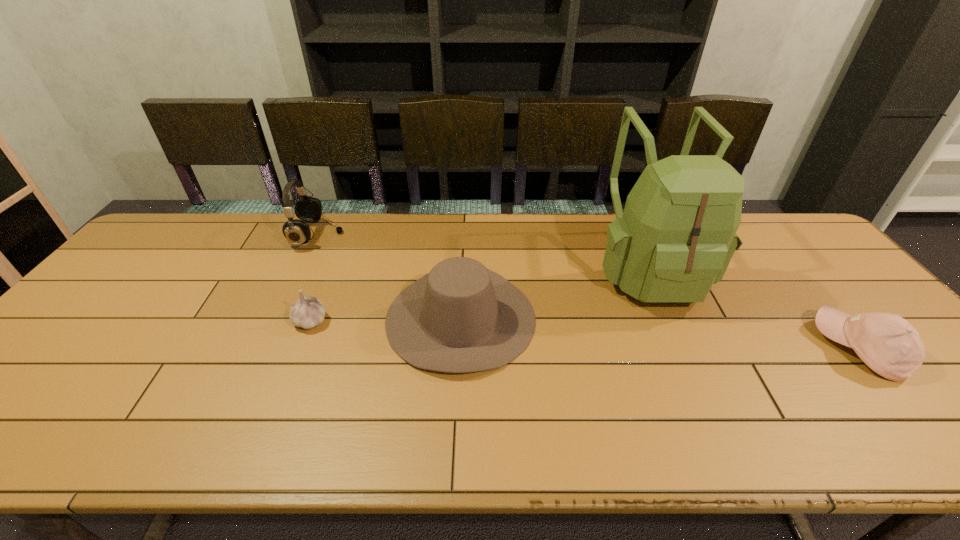
Image resolution: width=960 pixels, height=540 pixels. I want to click on blank space located 0.330m on the front-facing side of the rightmost object, so click(687, 348).

Where is `vacant space situated on the front-facing side of the rightmost object`? The height and width of the screenshot is (540, 960). vacant space situated on the front-facing side of the rightmost object is located at coordinates (760, 348).

You are a GUI agent. You are given a task and a screenshot of the screen. Output one action in this format:
    pyautogui.click(x=<x>, y=<y>)
    Task: Click on the free spot located on the front-facing side of the rightmost object
    
    Given the screenshot: What is the action you would take?
    pyautogui.click(x=675, y=348)

You are a GUI agent. You are given a task and a screenshot of the screen. Output one action in this format:
    pyautogui.click(x=<x>, y=<y>)
    Task: Click on the free space located 0.370m on the back of the garlic
    The width and height of the screenshot is (960, 540).
    Given the screenshot: What is the action you would take?
    pyautogui.click(x=347, y=230)

Locate an element on the screen. This screenshot has height=540, width=960. backpack present at the far edge is located at coordinates (675, 239).

This screenshot has height=540, width=960. Find the location of `headset present at the far edge`. headset present at the far edge is located at coordinates (308, 209).

You are a GUI agent. You are given a task and a screenshot of the screen. Output one action in this format:
    pyautogui.click(x=<x>, y=<y>)
    Task: Click on the object at the right edge
    Image resolution: width=960 pixels, height=540 pixels.
    Given the screenshot: What is the action you would take?
    pos(888,344)

In the image, there is a desktop. At what (x,y) coordinates should I click in order to perform the action: click on vacant space at the far edge. Please return your answer as a coordinate pair (x, y). Looking at the image, I should click on (365, 222).

Where is `vacant space at the left edge of the desktop`? Image resolution: width=960 pixels, height=540 pixels. vacant space at the left edge of the desktop is located at coordinates (39, 373).

At what (x,y) coordinates should I click in order to perform the action: click on blank space at the right edge of the desktop. Please return your answer as a coordinate pair (x, y). The height and width of the screenshot is (540, 960). Looking at the image, I should click on click(810, 277).